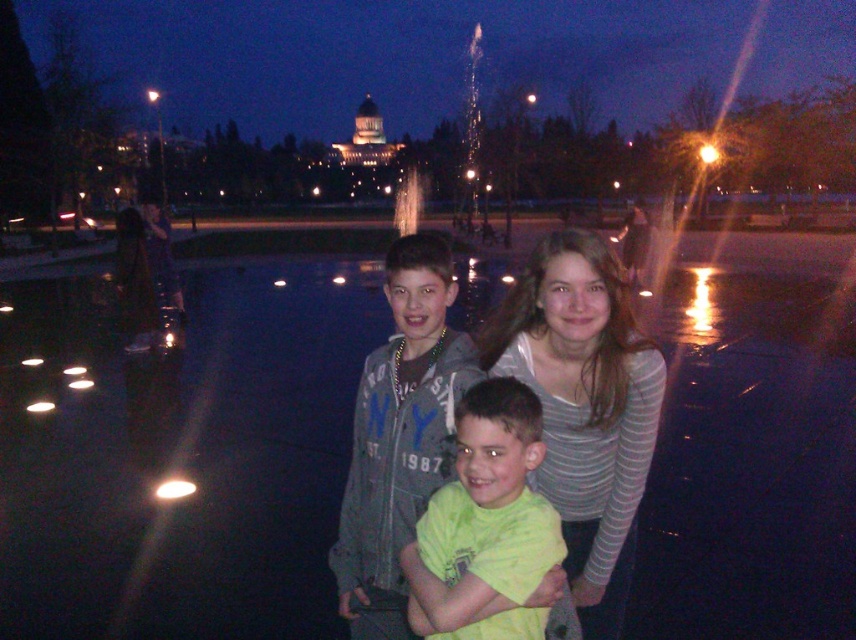
Question: Can you confirm if striped cotton shirt at center is bigger than green matte shirt at center?

Choices:
 (A) yes
 (B) no

Answer: (A)

Question: Is striped cotton shirt at center above green matte shirt at center?

Choices:
 (A) no
 (B) yes

Answer: (B)

Question: Which point appears closest to the camera in this image?

Choices:
 (A) (367, 472)
 (B) (428, 620)
 (C) (648, 468)

Answer: (B)

Question: Which is nearer to the striped cotton shirt at center?

Choices:
 (A) gray denim jacket at center
 (B) green matte shirt at center

Answer: (B)

Question: Which of the following is the farthest from the observer?

Choices:
 (A) (590, 522)
 (B) (456, 596)
 (C) (441, 416)

Answer: (C)

Question: Can you confirm if gray denim jacket at center is smaller than green matte shirt at center?

Choices:
 (A) no
 (B) yes

Answer: (A)